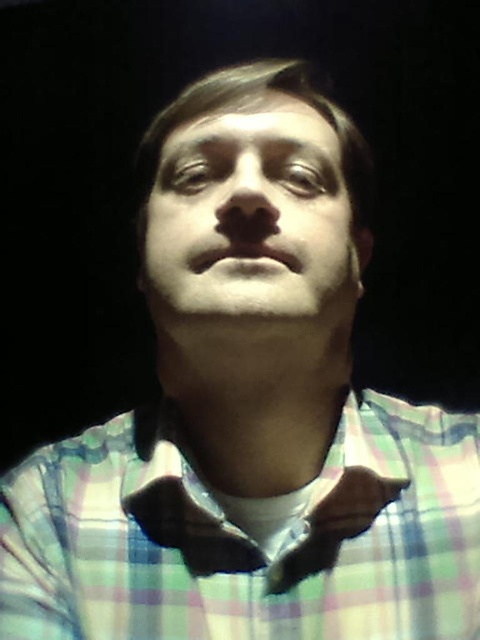
You are a photographer adjusting the lighting for a portrait. You notice the checkered fabric shirt at center and the brown leather bow tie at center. Which object should you focus the light on to ensure it appears brighter in the photo?

The checkered fabric shirt at center is closer to the viewer than the brown leather bow tie at center, so focusing the light on the checkered fabric shirt at center will make it appear brighter in the photo.

You are a tailor who needs to adjust the size of the brown leather bow tie at center to match the checkered fabric shirt at center. Based on the image, which item is wider so you know how to adjust the bow tie?

The checkered fabric shirt at center is wider than the brown leather bow tie at center, so you should widen the brown leather bow tie at center to match the shirt.

You are a fashion designer preparing for a photoshoot. You need to decide whether the checkered fabric shirt at center will cover the brown leather bow tie at center in the image. Based on their sizes, what do you think?

The checkered fabric shirt at center is much taller than the brown leather bow tie at center, so it will cover it completely.